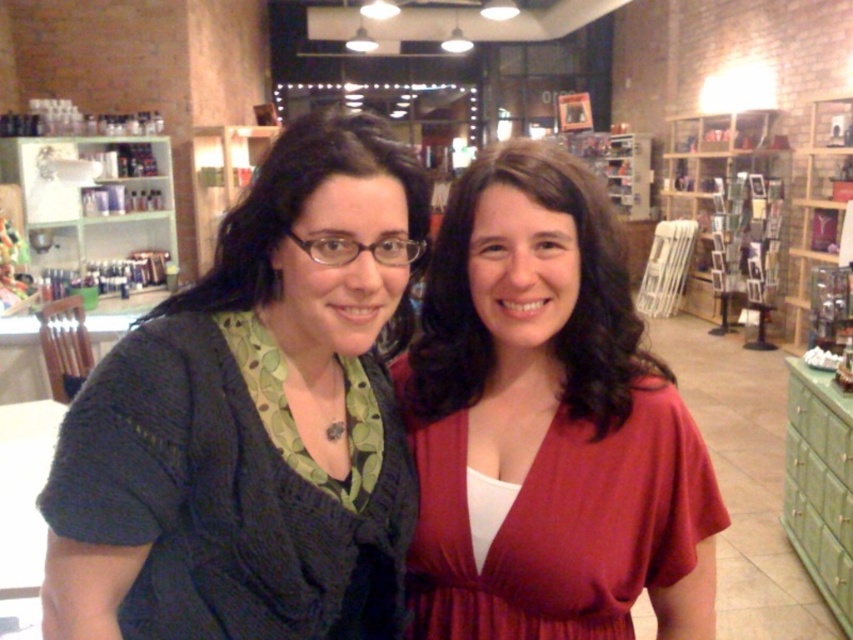
Question: Estimate the real-world distances between objects in this image. Which object is farther from the wooden bookshelf at upper right?

Choices:
 (A) green glass shelves at upper left
 (B) green wood cabinet at lower right

Answer: (A)

Question: From the image, what is the correct spatial relationship of matte red dress at center in relation to green wood cabinet at lower right?

Choices:
 (A) below
 (B) above

Answer: (B)

Question: Does knitted dark gray sweater at left appear under matte red dress at center?

Choices:
 (A) no
 (B) yes

Answer: (A)

Question: Which point appears farthest from the camera in this image?

Choices:
 (A) (843, 461)
 (B) (219, 512)

Answer: (A)

Question: Which of these objects is positioned farthest from the knitted dark gray sweater at left?

Choices:
 (A) green wood cabinet at lower right
 (B) matte red dress at center

Answer: (A)

Question: Does matte red dress at center have a larger size compared to wooden bookshelf at upper right?

Choices:
 (A) no
 (B) yes

Answer: (A)